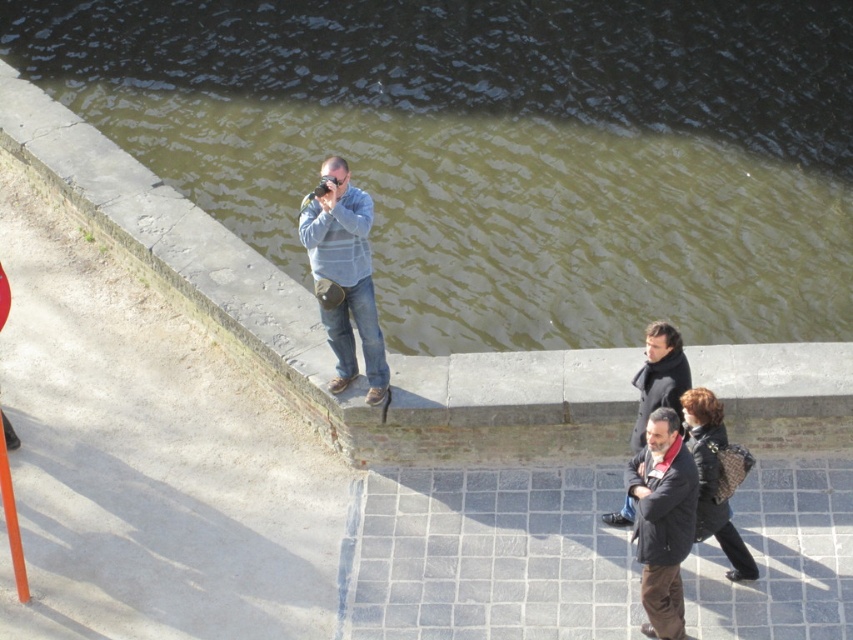
You are a photographer standing on the embankment and want to capture both the greenish water at upper center and the black textured coat at lower right in your shot. Since you need to adjust your camera to fit both objects, which object requires you to zoom out more to include in the frame?

The greenish water at upper center requires zooming out more because its width is greater than the black textured coat at lower right.

You are a photographer standing on the embankment and want to position yourself so that the greenish water at upper center and the black textured coat at lower right are both visible in your shot. Which object should you adjust your angle to prioritize capturing first?

The greenish water at upper center is above the black textured coat at lower right, so you should prioritize capturing the greenish water at upper center first as it is higher in the frame.

You are a photographer standing on the embankment and you see the light blue sweater at center and the black textured coat at lower right. Which clothing item is taller?

The light blue sweater at center is taller than the black textured coat at lower right according to the description.